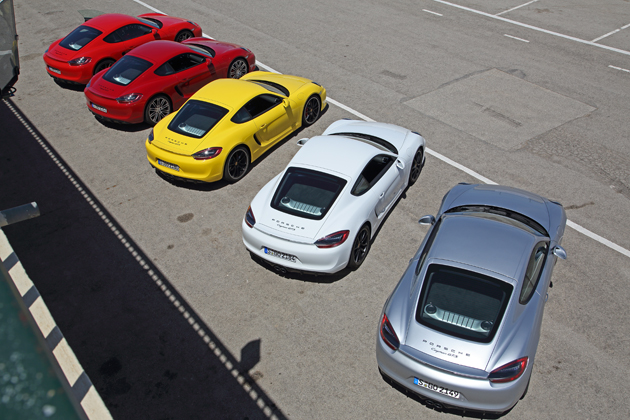
Locate an element on the screen. hoods is located at coordinates (517, 200), (394, 139), (290, 84), (222, 50), (171, 17).